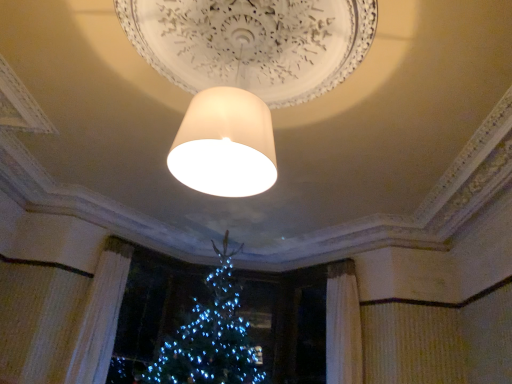
In order to face matte white lampshade at center, should I rotate leftwards or rightwards?

To face it directly, rotate left by 3.105 degrees.

The width and height of the screenshot is (512, 384). What do you see at coordinates (244, 75) in the screenshot? I see `matte white lampshade at center` at bounding box center [244, 75].

Image resolution: width=512 pixels, height=384 pixels. What are the coordinates of `matte white lampshade at center` in the screenshot? It's located at (244, 75).

The height and width of the screenshot is (384, 512). Describe the element at coordinates (101, 315) in the screenshot. I see `white textured curtain at lower left` at that location.

At what (x,y) coordinates should I click in order to perform the action: click on white textured curtain at lower left. Please return your answer as a coordinate pair (x, y). This screenshot has width=512, height=384. Looking at the image, I should click on (101, 315).

Where is `matte white lampshade at center`? This screenshot has width=512, height=384. matte white lampshade at center is located at coordinates (244, 75).

Is white textured curtain at lower left at the left side of matte white lampshade at center?

Correct, you'll find white textured curtain at lower left to the left of matte white lampshade at center.

Is the position of white textured curtain at lower left more distant than that of matte white lampshade at center?

Yes, it is.

Which is in front, point (87, 347) or point (334, 78)?

The point (334, 78) is closer.

From the image's perspective, is white textured curtain at lower left located above or below matte white lampshade at center?

From the image's perspective, white textured curtain at lower left appears below matte white lampshade at center.

From a real-world perspective, between white textured curtain at lower left and matte white lampshade at center, who is vertically higher?

From a 3D spatial view, matte white lampshade at center is above.

Considering the relative sizes of white textured curtain at lower left and matte white lampshade at center in the image provided, is white textured curtain at lower left thinner than matte white lampshade at center?

Yes.

Considering the sizes of objects white textured curtain at lower left and matte white lampshade at center in the image provided, who is taller, white textured curtain at lower left or matte white lampshade at center?

white textured curtain at lower left is taller.

Looking at the image, does white textured curtain at lower left seem bigger or smaller compared to matte white lampshade at center?

Clearly, white textured curtain at lower left is smaller in size than matte white lampshade at center.

Can we say white textured curtain at lower left lies outside matte white lampshade at center?

That's correct, white textured curtain at lower left is outside of matte white lampshade at center.

Is white textured curtain at lower left beside matte white lampshade at center?

No, white textured curtain at lower left is not making contact with matte white lampshade at center.

Is white textured curtain at lower left facing away from matte white lampshade at center?

white textured curtain at lower left is not turned away from matte white lampshade at center.

Measure the distance between white textured curtain at lower left and matte white lampshade at center.

white textured curtain at lower left and matte white lampshade at center are 4.61 meters apart.

Where is `lamp lying above the white textured curtain at lower left (from the image's perspective)`? lamp lying above the white textured curtain at lower left (from the image's perspective) is located at coordinates (244, 75).

In the image, is matte white lampshade at center on the left side or the right side of white textured curtain at lower left?

Clearly, matte white lampshade at center is on the right of white textured curtain at lower left in the image.

Which object is closer to the camera taking this photo, matte white lampshade at center or white textured curtain at lower left?

matte white lampshade at center is in front.

Is point (301, 63) positioned in front of point (104, 379)?

That is True.

From the image's perspective, is matte white lampshade at center under white textured curtain at lower left?

No, from the image's perspective, matte white lampshade at center is not beneath white textured curtain at lower left.

From a real-world perspective, between matte white lampshade at center and white textured curtain at lower left, who is vertically higher?

matte white lampshade at center.

Which object is wider, matte white lampshade at center or white textured curtain at lower left?

matte white lampshade at center.

Which of these two, matte white lampshade at center or white textured curtain at lower left, stands shorter?

matte white lampshade at center.

Is matte white lampshade at center bigger than white textured curtain at lower left?

Yes, matte white lampshade at center is bigger than white textured curtain at lower left.

Choose the correct answer: Is matte white lampshade at center inside white textured curtain at lower left or outside it?

matte white lampshade at center lies outside white textured curtain at lower left.

Would you say matte white lampshade at center is a long distance from white textured curtain at lower left?

Yes, matte white lampshade at center and white textured curtain at lower left are quite far apart.

Does matte white lampshade at center turn towards white textured curtain at lower left?

No, matte white lampshade at center is not oriented towards white textured curtain at lower left.

The image size is (512, 384). In the image, there is a white textured curtain at lower left. Find the location of `lamp above it (from the image's perspective)`. lamp above it (from the image's perspective) is located at coordinates (244, 75).

At what (x,y) coordinates should I click in order to perform the action: click on curtain that is under the matte white lampshade at center (from a real-world perspective). Please return your answer as a coordinate pair (x, y). The image size is (512, 384). Looking at the image, I should click on (101, 315).

This screenshot has height=384, width=512. I want to click on curtain below the matte white lampshade at center (from the image's perspective), so click(101, 315).